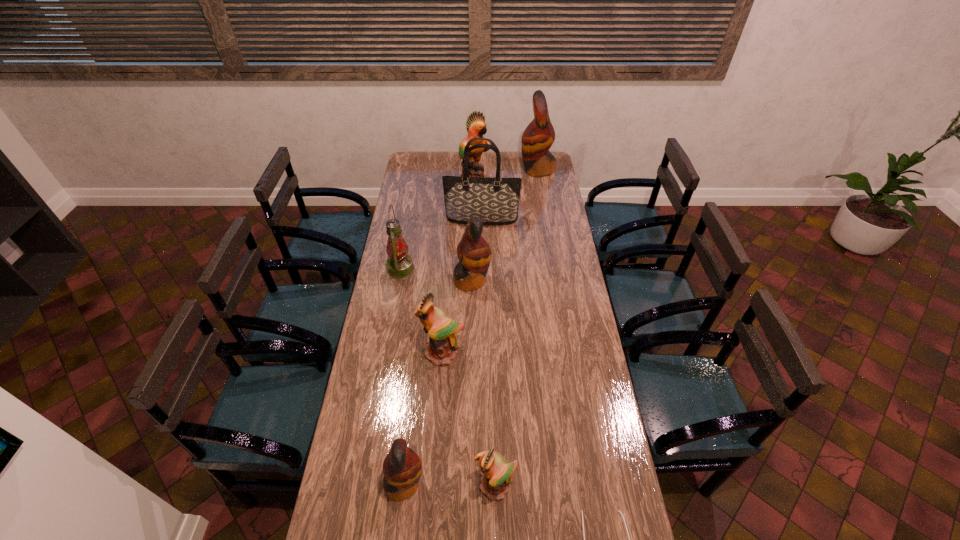
You are a GUI agent. You are given a task and a screenshot of the screen. Output one action in this format:
    pyautogui.click(x=<x>, y=<y>)
    Task: Click on the leftmost object
    The height and width of the screenshot is (540, 960).
    Given the screenshot: What is the action you would take?
    pyautogui.click(x=399, y=263)

Find the location of a particular element. the leftmost red parrot is located at coordinates 402,467.

The width and height of the screenshot is (960, 540). Identify the location of the nearest red parrot. (402, 467).

Identify the location of the nearest green parrot. Image resolution: width=960 pixels, height=540 pixels. pos(496,472).

The image size is (960, 540). Find the location of `vacant space situated 0.260m on the front-facing side of the biggest green parrot`. vacant space situated 0.260m on the front-facing side of the biggest green parrot is located at coordinates (536, 184).

The image size is (960, 540). In order to click on free location located on the face of the rightmost red parrot in this screenshot , I will do `click(509, 170)`.

At what (x,y) coordinates should I click in order to perform the action: click on blank area located 0.200m on the face of the rightmost red parrot. Please return your answer as a coordinate pair (x, y). The width and height of the screenshot is (960, 540). Looking at the image, I should click on (485, 170).

The image size is (960, 540). I want to click on blank space located on the face of the rightmost red parrot, so click(504, 170).

Where is `free point located on the front of the tote bag`? This screenshot has width=960, height=540. free point located on the front of the tote bag is located at coordinates (482, 276).

The height and width of the screenshot is (540, 960). Identify the location of vacant region located on the face of the second red parrot from right to left. tap(569, 280).